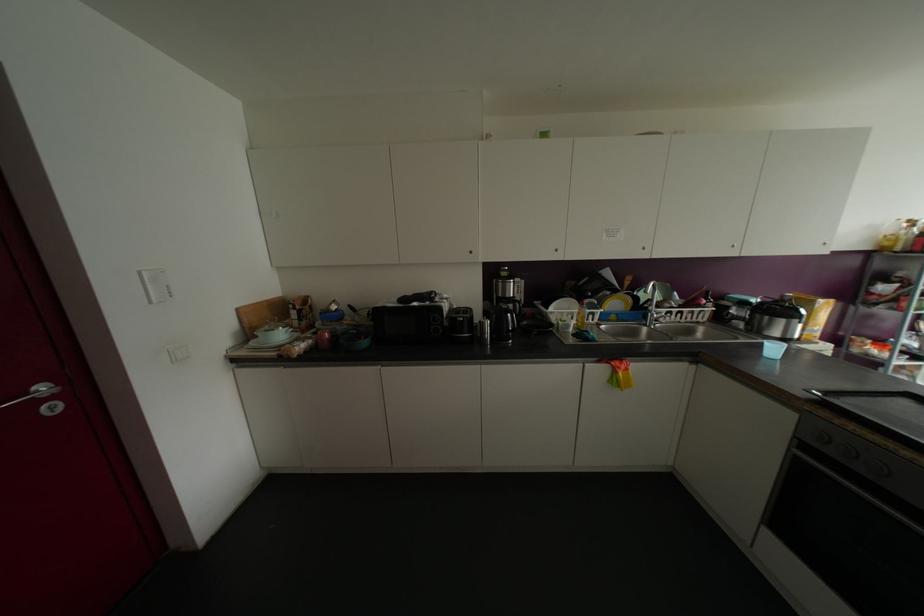
The width and height of the screenshot is (924, 616). What do you see at coordinates (33, 394) in the screenshot? I see `the silver door handle` at bounding box center [33, 394].